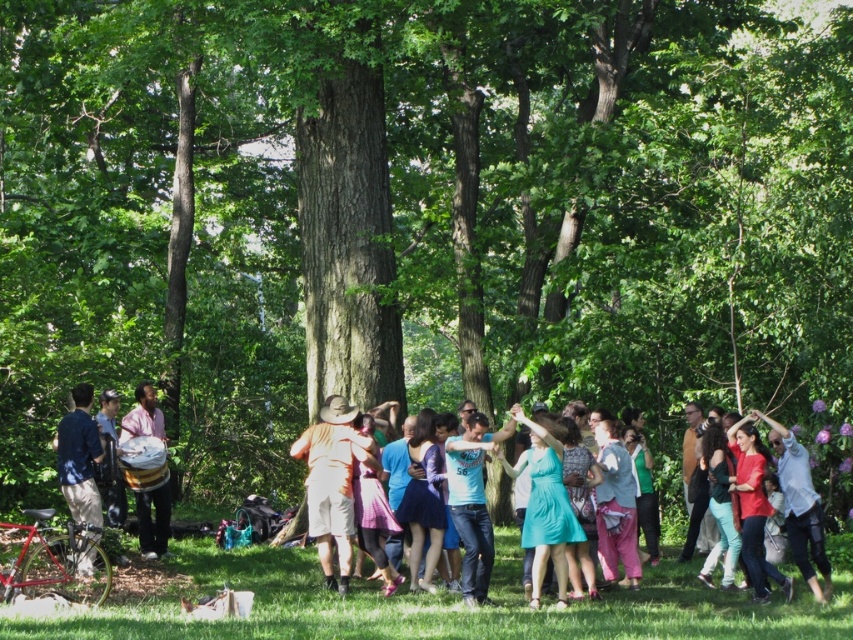
Which is in front, point (397, 624) or point (152, 387)?

Point (397, 624) is more forward.

Can you confirm if green grass at lower center is wider than matte brown drum at left?

Yes, green grass at lower center is wider than matte brown drum at left.

This screenshot has width=853, height=640. I want to click on green grass at lower center, so click(444, 605).

Does point (735, 609) come in front of point (320, 428)?

Yes.

Can you confirm if green grass at lower center is wider than camouflage-patterned shorts at center?

Indeed, green grass at lower center has a greater width compared to camouflage-patterned shorts at center.

The width and height of the screenshot is (853, 640). Describe the element at coordinates (444, 605) in the screenshot. I see `green grass at lower center` at that location.

Locate an element on the screen. The image size is (853, 640). green grass at lower center is located at coordinates (444, 605).

Is orange cotton shirt at center positioned in front of camouflage-patterned shorts at center?

Yes, orange cotton shirt at center is closer to the viewer.

The width and height of the screenshot is (853, 640). Find the location of `orange cotton shirt at center`. orange cotton shirt at center is located at coordinates (753, 508).